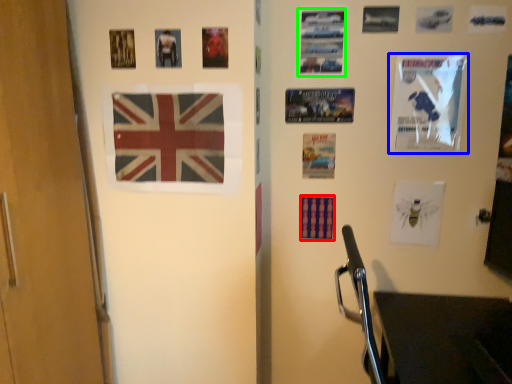
Question: Estimate the real-world distances between objects in this image. Which object is closer to flag (highlighted by a red box), poster page (highlighted by a blue box) or poster page (highlighted by a green box)?

Choices:
 (A) poster page
 (B) poster page

Answer: (A)